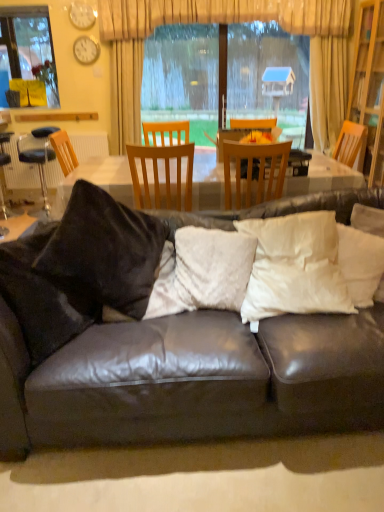
Question: In terms of size, does white soft pillow at right, the 3th pillow viewed from the left, appear bigger or smaller than matte white clock at upper left, arranged as the 2th clock when ordered from the bottom?

Choices:
 (A) small
 (B) big

Answer: (B)

Question: Relative to matte white clock at upper left, arranged as the 2th clock when ordered from the bottom, is white soft pillow at right, the 3th pillow viewed from the left, in front or behind?

Choices:
 (A) front
 (B) behind

Answer: (A)

Question: Which of these objects is positioned farthest from the white soft pillow at center, positioned as the second pillow in left-to-right order?

Choices:
 (A) matte white clock at upper left, the 2th clock when ordered from top to bottom
 (B) clear glass window at upper left
 (C) wooden chair at center, the second chair when ordered from left to right
 (D) black leather bar stool at left
 (E) beige fabric curtain at upper center

Answer: (B)

Question: Estimate the real-world distances between objects in this image. Which object is closer to the beige fabric curtain at upper center?

Choices:
 (A) clear glass window at upper left
 (B) white fluffy pillow at center, which appears as the 3th pillow when viewed from the right
 (C) wooden bookshelf at right
 (D) leather couch with pillows at center
 (E) black leather bar stool at left

Answer: (C)